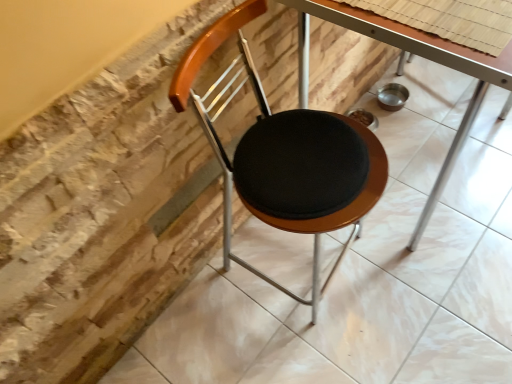
Where is `free space in front of metallic silver table at center`? This screenshot has width=512, height=384. free space in front of metallic silver table at center is located at coordinates (436, 292).